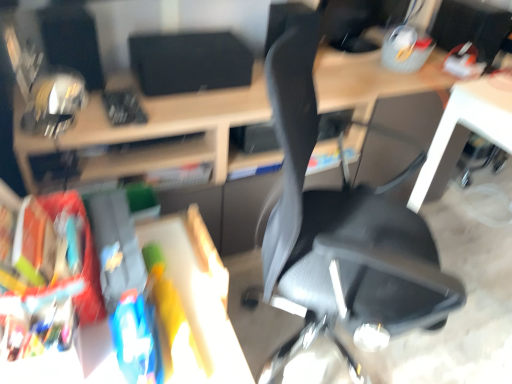
Question: Is black matte speaker at upper center, which is the 2th computer monitor from right to left, shorter than matte black desk at center?

Choices:
 (A) yes
 (B) no

Answer: (A)

Question: Would you say black matte speaker at upper center, which is the 2th computer monitor from right to left, contains matte black desk at center?

Choices:
 (A) yes
 (B) no

Answer: (B)

Question: Considering the relative sizes of black matte speaker at upper center, which is the 2th computer monitor from right to left, and matte black desk at center in the image provided, is black matte speaker at upper center, which is the 2th computer monitor from right to left, smaller than matte black desk at center?

Choices:
 (A) no
 (B) yes

Answer: (B)

Question: Considering the relative positions of black matte speaker at upper center, the first computer monitor from the left, and matte black desk at center in the image provided, is black matte speaker at upper center, the first computer monitor from the left, to the right of matte black desk at center from the viewer's perspective?

Choices:
 (A) no
 (B) yes

Answer: (A)

Question: Is black matte speaker at upper center, the first computer monitor from the left, far from matte black desk at center?

Choices:
 (A) no
 (B) yes

Answer: (A)

Question: Is matte black desk at center inside or outside of black mesh chair at center?

Choices:
 (A) inside
 (B) outside

Answer: (B)

Question: Considering the positions of matte black desk at center and black mesh chair at center in the image, is matte black desk at center wider or thinner than black mesh chair at center?

Choices:
 (A) thin
 (B) wide

Answer: (A)

Question: Considering the positions of matte black desk at center and black mesh chair at center in the image, is matte black desk at center bigger or smaller than black mesh chair at center?

Choices:
 (A) big
 (B) small

Answer: (A)

Question: From a real-world perspective, is matte black desk at center above or below black mesh chair at center?

Choices:
 (A) below
 (B) above

Answer: (A)

Question: From their relative heights in the image, would you say matte black desk at center is taller or shorter than black matte speaker at upper center, the first computer monitor from the left?

Choices:
 (A) tall
 (B) short

Answer: (A)

Question: In the image, is matte black desk at center positioned in front of or behind black matte speaker at upper center, the first computer monitor from the left?

Choices:
 (A) behind
 (B) front

Answer: (B)

Question: Does point (181, 110) appear closer or farther from the camera than point (205, 74)?

Choices:
 (A) closer
 (B) farther

Answer: (A)

Question: From the image's perspective, is matte black desk at center above or below black matte speaker at upper center, which is the 2th computer monitor from right to left?

Choices:
 (A) above
 (B) below

Answer: (B)

Question: From a real-world perspective, relative to matte black monitor at upper right, which is counted as the second computer monitor, starting from the left, is black matte speaker at upper center, which is the 2th computer monitor from right to left, vertically above or below?

Choices:
 (A) below
 (B) above

Answer: (A)

Question: From the image's perspective, is black matte speaker at upper center, the first computer monitor from the left, located above or below matte black monitor at upper right, which is the first computer monitor from right to left?

Choices:
 (A) above
 (B) below

Answer: (B)